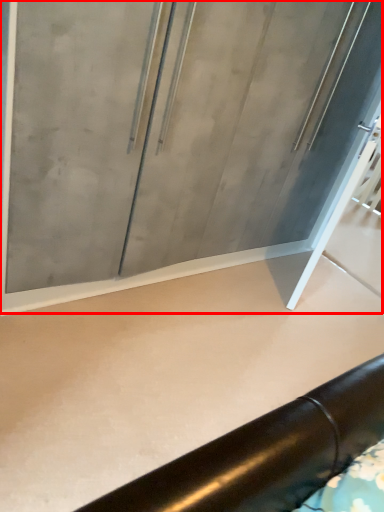
Question: From the image's perspective, where is glass door (annotated by the red box) located relative to concrete?

Choices:
 (A) above
 (B) below

Answer: (A)